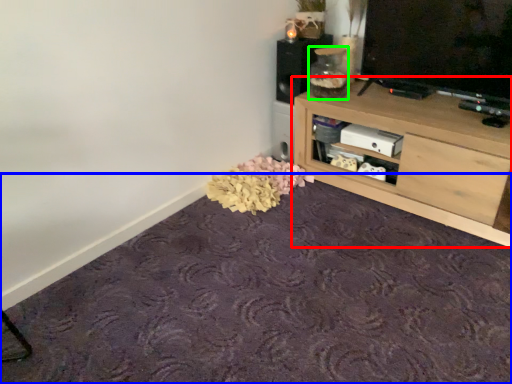
Question: Based on their relative distances, which object is nearer to shelf (highlighted by a red box)? Choose from plain (highlighted by a blue box) and glass jar (highlighted by a green box).

Choices:
 (A) plain
 (B) glass jar

Answer: (B)